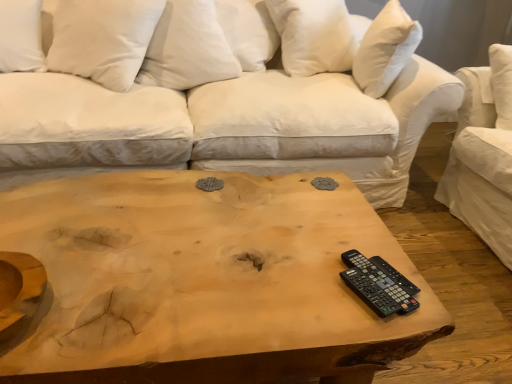
Question: Is white cotton studio couch at center inside the boundaries of natural wood coffee table at center, or outside?

Choices:
 (A) outside
 (B) inside

Answer: (A)

Question: Is point click(x=323, y=157) positioned closer to the camera than point click(x=164, y=334)?

Choices:
 (A) closer
 (B) farther

Answer: (B)

Question: Which object is positioned closest to the white soft pillow at upper left, positioned as the 2th pillow in left-to-right order?

Choices:
 (A) natural wood coffee table at center
 (B) white soft pillow at upper right, which appears as the first pillow when viewed from the right
 (C) white cotton pillow at upper center, marked as the second pillow in a right-to-left arrangement
 (D) black plastic remote at lower right
 (E) white soft pillow at upper left, arranged as the fourth pillow when viewed from the right

Answer: (C)

Question: Estimate the real-world distances between objects in this image. Which object is closer to the white soft pillow at upper left, the 1th pillow positioned from the left?

Choices:
 (A) natural wood coffee table at center
 (B) white cotton pillow at upper center, the third pillow from the left
 (C) black plastic remote at lower right
 (D) white cotton studio couch at center
 (E) white soft pillow at upper right, the 4th pillow in the left-to-right sequence

Answer: (B)